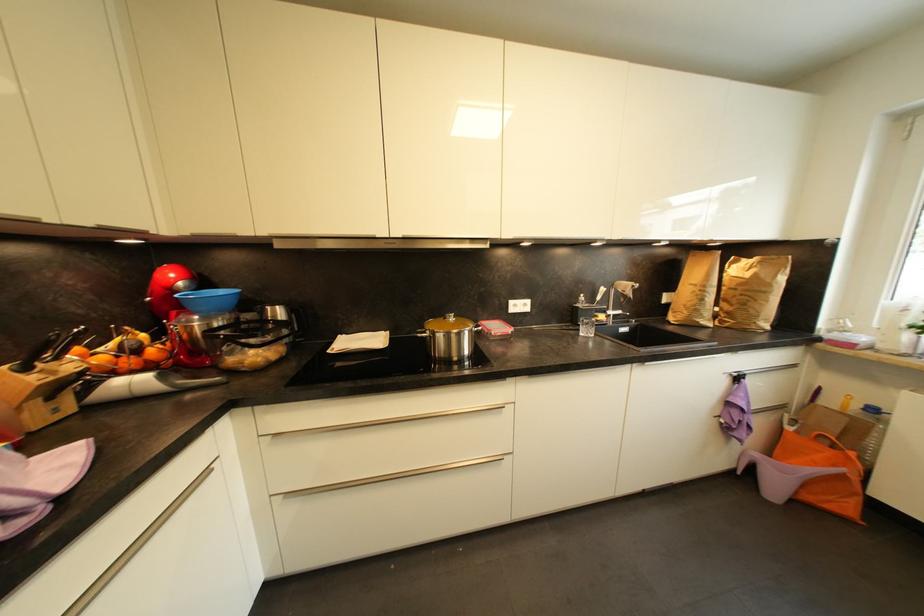
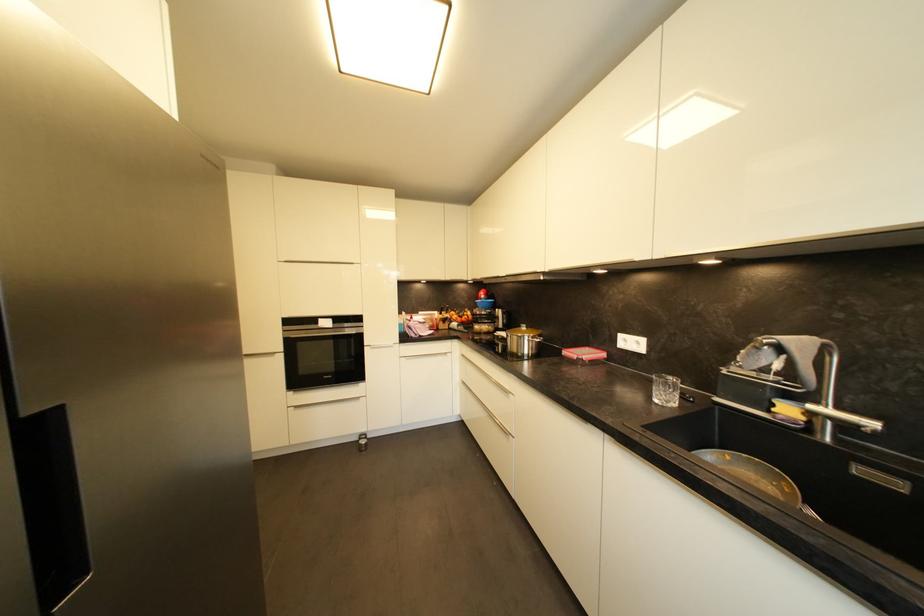
The point at (606, 318) is marked in the first image. Where is the corresponding point in the second image?

(793, 411)